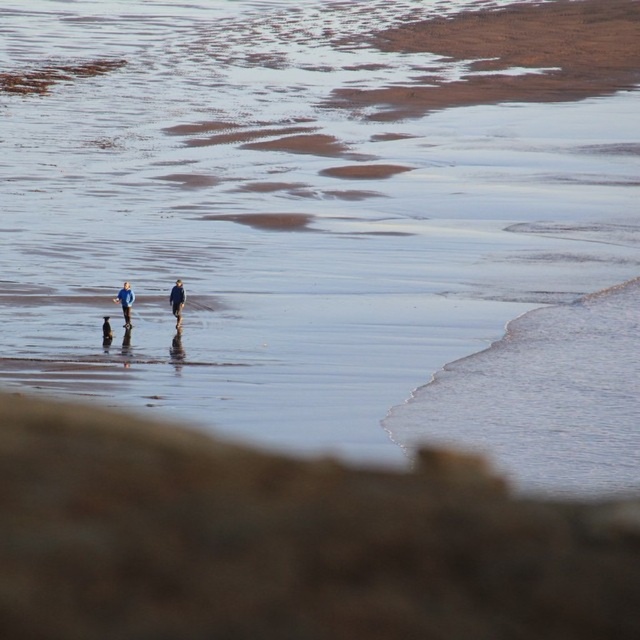
Question: Which of the following is the farthest from the observer?

Choices:
 (A) (205, 460)
 (B) (125, 324)
 (C) (177, 300)

Answer: (C)

Question: Which of the following is the closest to the observer?

Choices:
 (A) brown sandy beach at lower center
 (B) blue fabric jacket at left

Answer: (A)

Question: From the image, what is the correct spatial relationship of brown sandy beach at lower center in relation to blue fabric jacket at left?

Choices:
 (A) left
 (B) right

Answer: (B)

Question: Is brown sandy beach at lower center closer to the viewer compared to blue fabric jacket at left?

Choices:
 (A) yes
 (B) no

Answer: (A)

Question: Which point is farther from the camera taking this photo?

Choices:
 (A) (83, 540)
 (B) (129, 314)

Answer: (B)

Question: Is brown sandy beach at lower center behind dark blue fabric at center?

Choices:
 (A) no
 (B) yes

Answer: (A)